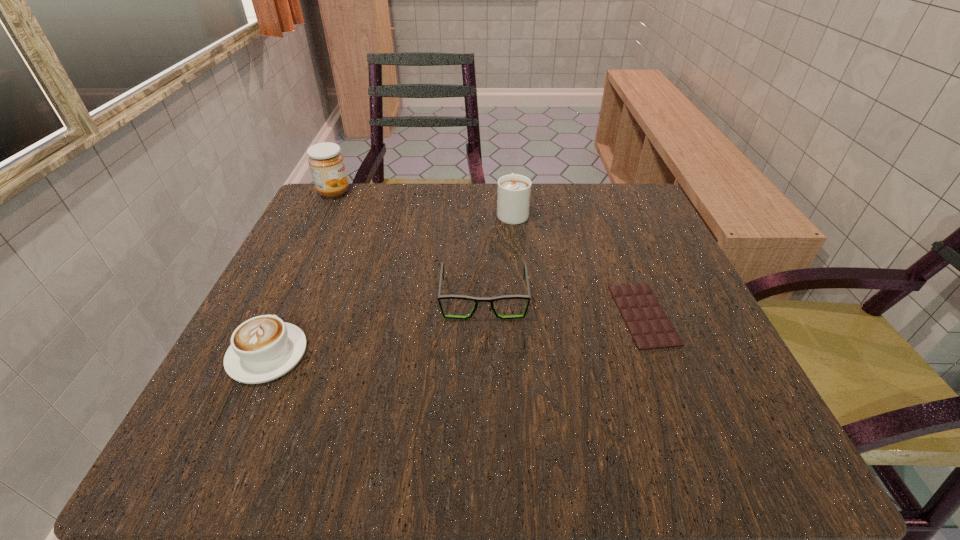
The height and width of the screenshot is (540, 960). Identify the location of free location that satisfies the following two spatial constraints: 1. on the front label of the chocolate bar; 2. on the right side of the jam. (274, 315).

Where is `blank area in the image that satisfies the following two spatial constraints: 1. on the side with the handle of the right cappuccino; 2. on the front label of the jam`? This screenshot has height=540, width=960. blank area in the image that satisfies the following two spatial constraints: 1. on the side with the handle of the right cappuccino; 2. on the front label of the jam is located at coordinates (511, 192).

Image resolution: width=960 pixels, height=540 pixels. I want to click on vacant space that satisfies the following two spatial constraints: 1. with the handle on the right side of the shortest object; 2. on the right side of the left cappuccino, so click(285, 315).

Image resolution: width=960 pixels, height=540 pixels. I want to click on free spot that satisfies the following two spatial constraints: 1. on the front label of the jam; 2. with the handle on the right side of the nearer cappuccino, so click(254, 354).

You are a GUI agent. You are given a task and a screenshot of the screen. Output one action in this format:
    pyautogui.click(x=<x>, y=<y>)
    Task: Click on the vacant position in the image that satisfies the following two spatial constraints: 1. on the front label of the tallest object; 2. with the handle on the right side of the left cappuccino
    The image size is (960, 540).
    Given the screenshot: What is the action you would take?
    pyautogui.click(x=254, y=354)